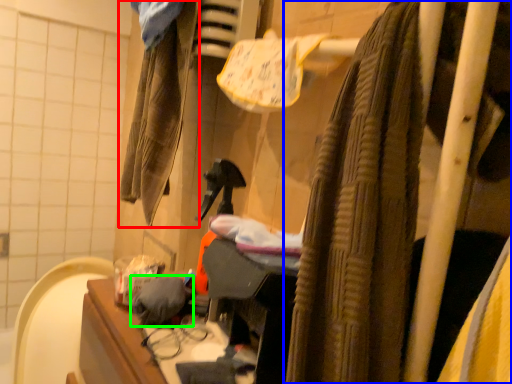
Question: Which object is the closest to the clothing (highlighted by a red box)? Choose among these: curtain (highlighted by a blue box) or clothing (highlighted by a green box).

Choices:
 (A) curtain
 (B) clothing

Answer: (B)